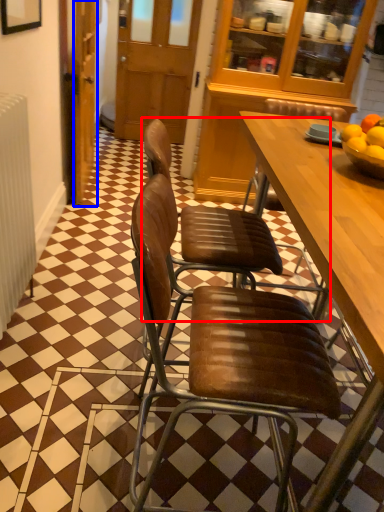
Question: Among these objects, which one is farthest to the camera, chair (highlighted by a red box) or door (highlighted by a blue box)?

Choices:
 (A) chair
 (B) door

Answer: (B)